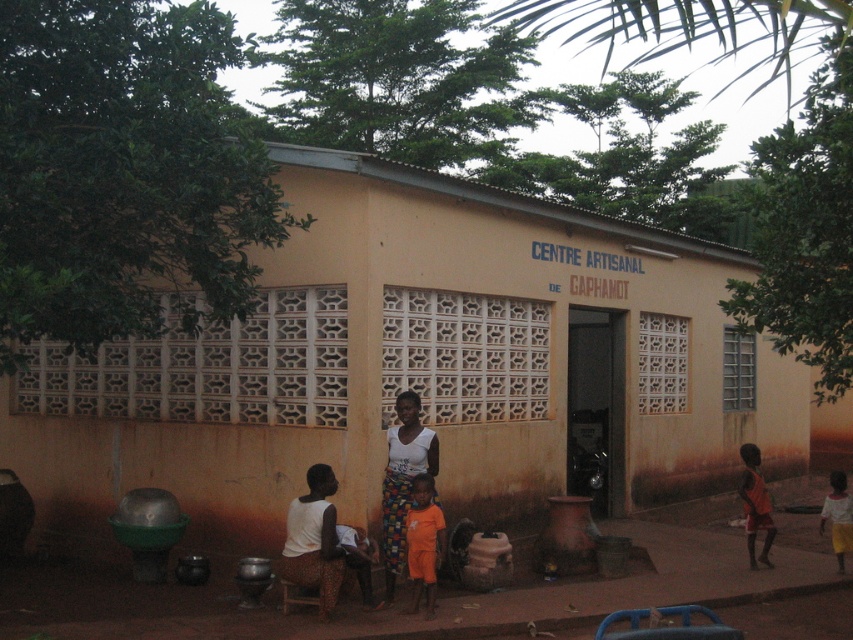
You are standing on the sidewalk in front of the yellow matte building at center. You want to hand a flyer to the orange fabric child at lower right. Which direction should you walk to reach them?

The yellow matte building at center is located above the orange fabric child at lower right, so you should walk downward or towards the lower part of the scene to reach the orange fabric child at lower right.

From the picture: You are a photographer standing in front of the building. You want to take a photo that includes both the orange fabric at center and the orange fabric child at lower right. Which object should you focus on first to ensure both are in the frame?

You should focus on the orange fabric at center first since it is closer to the viewer, allowing you to adjust the frame to include both the orange fabric at center and the orange fabric child at lower right.

From the picture: You are a visitor at the CENTRE ARTISANAL DE CAPHAMOT and want to find the orange fabric at center and the orange fabric child at lower right. Which one is smaller in size?

The orange fabric at center is smaller in size compared to the orange fabric child at lower right.